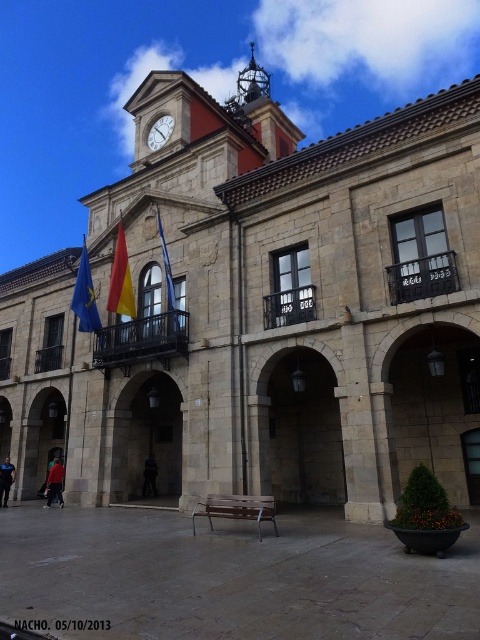
Question: Is brown wooden bench at center positioned in front of polished brass bell tower at upper center?

Choices:
 (A) yes
 (B) no

Answer: (A)

Question: Which object appears closest to the camera in this image?

Choices:
 (A) red fabric flag at center
 (B) wooden bench at center
 (C) polished brass bell tower at upper center

Answer: (B)

Question: Does brown wooden bench at center appear over blue fabric flag at center?

Choices:
 (A) yes
 (B) no

Answer: (B)

Question: Which point is closer to the camera taking this photo?

Choices:
 (A) (129, 276)
 (B) (296, 557)
 (C) (172, 308)
 (D) (257, 65)

Answer: (B)

Question: Can you confirm if wooden bench at center is smaller than polished brass bell tower at upper center?

Choices:
 (A) yes
 (B) no

Answer: (A)

Question: Which of the following is the farthest from the observer?

Choices:
 (A) (255, 84)
 (B) (271, 513)
 (C) (172, 118)

Answer: (A)